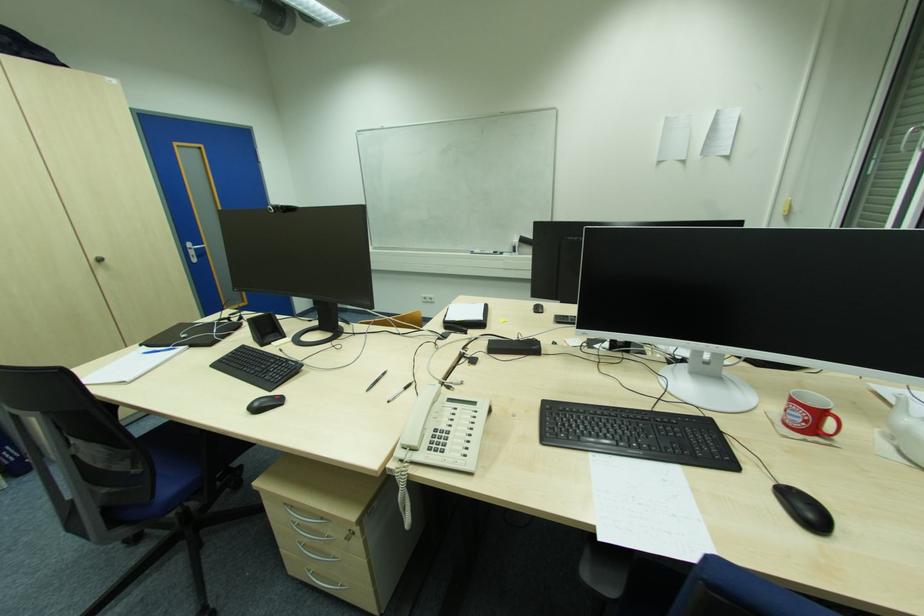
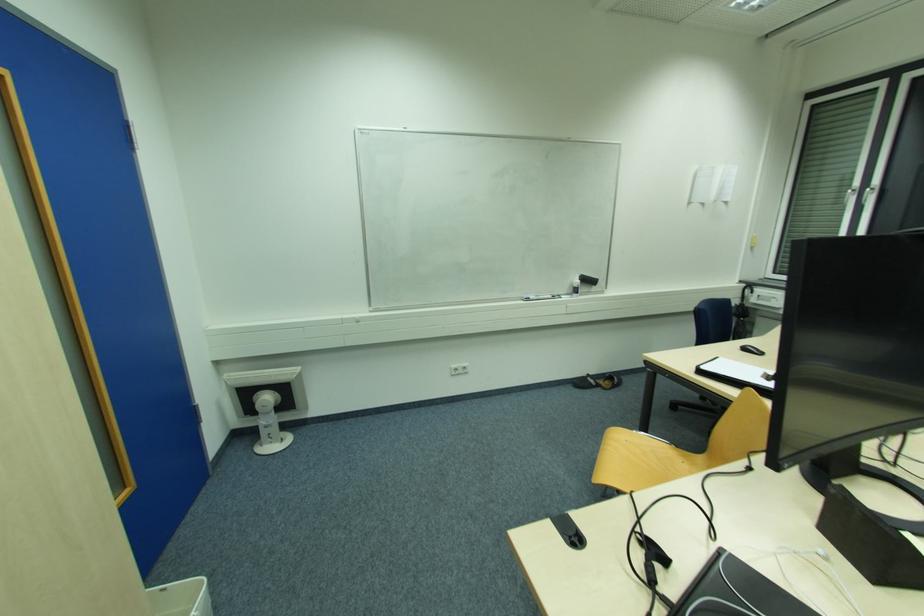
Question: I am providing you with two images of the same scene from different viewpoints. Which of the following objects are not visible in image2?

Choices:
 (A) whiteboard marker
 (B) small spray bottle
 (C) white window handle
 (D) none of these

Answer: (D)